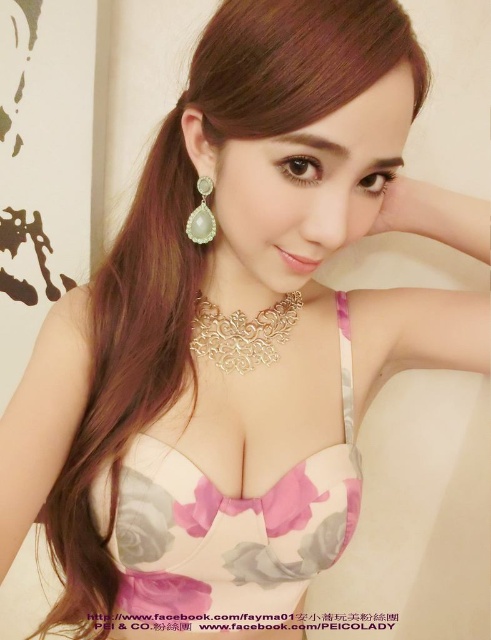
Which is below, brown shiny hair at center or gold textured necklace at center?

brown shiny hair at center is lower down.

The image size is (491, 640). What do you see at coordinates (128, 365) in the screenshot? I see `brown shiny hair at center` at bounding box center [128, 365].

Find the location of a particular element. The width and height of the screenshot is (491, 640). brown shiny hair at center is located at coordinates (128, 365).

How much distance is there between pink satin bikini top at center and pearl-like stone earring at left?

A distance of 14.19 inches exists between pink satin bikini top at center and pearl-like stone earring at left.

Is point (298, 525) behind point (189, 227)?

No, it is in front of (189, 227).

Find the location of `pink satin bikini top at center`. pink satin bikini top at center is located at coordinates (226, 529).

Can you confirm if gold textured necklace at center is positioned to the right of pearl-like stone earring at left?

Correct, you'll find gold textured necklace at center to the right of pearl-like stone earring at left.

Where is `gold textured necklace at center`? Image resolution: width=491 pixels, height=640 pixels. gold textured necklace at center is located at coordinates (242, 333).

Identify the location of gold textured necklace at center. (242, 333).